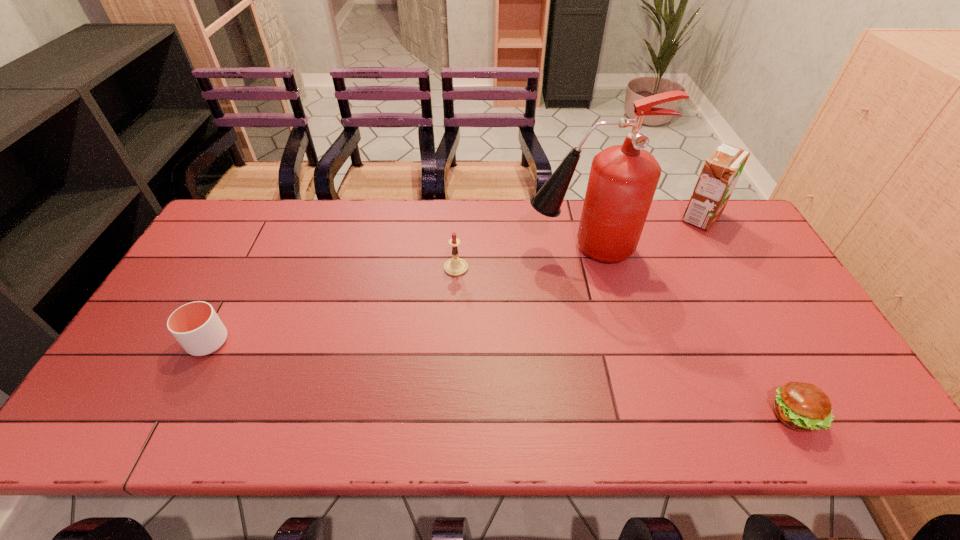
The height and width of the screenshot is (540, 960). Identify the location of free spot located with the nozzle aimed from the tallest object. (468, 248).

Where is `vacant space situated with the nozzle aimed from the tallest object`? This screenshot has height=540, width=960. vacant space situated with the nozzle aimed from the tallest object is located at coordinates (449, 248).

I want to click on blank space located on the straw side of the carton, so click(x=608, y=217).

This screenshot has width=960, height=540. Identify the location of vacant space situated on the straw side of the carton. (582, 217).

Find the location of `free space located 0.370m on the straw side of the carton`. free space located 0.370m on the straw side of the carton is located at coordinates (569, 217).

Locate an element on the screen. blank space located on the left of the candle is located at coordinates (311, 268).

Identify the location of vacant area situated on the right of the fourth farthest object. (321, 342).

Where is `free point located on the back of the shortest object`? The width and height of the screenshot is (960, 540). free point located on the back of the shortest object is located at coordinates (756, 342).

The image size is (960, 540). I want to click on fire extinguisher present at the far edge, so click(623, 179).

In order to click on carton present at the far edge in this screenshot , I will do `click(722, 169)`.